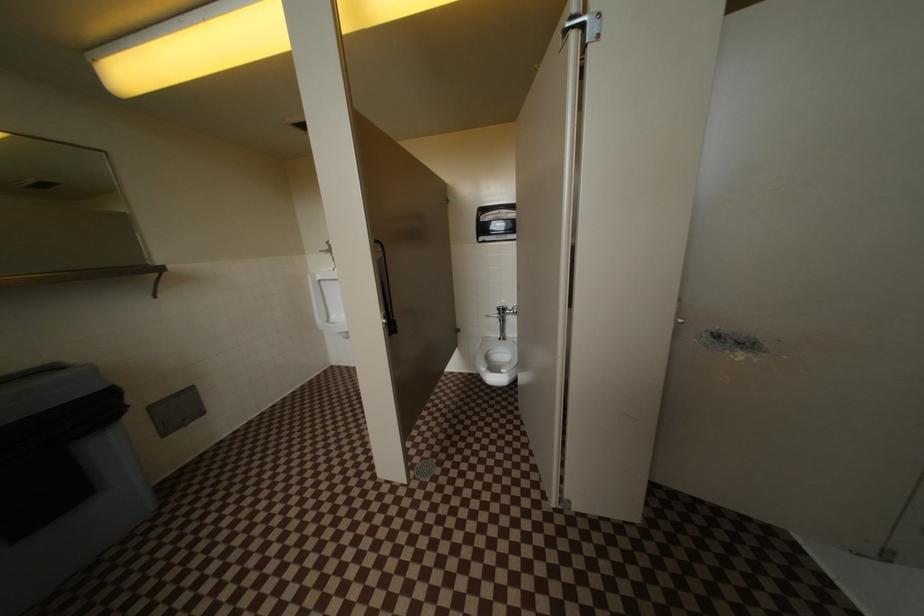
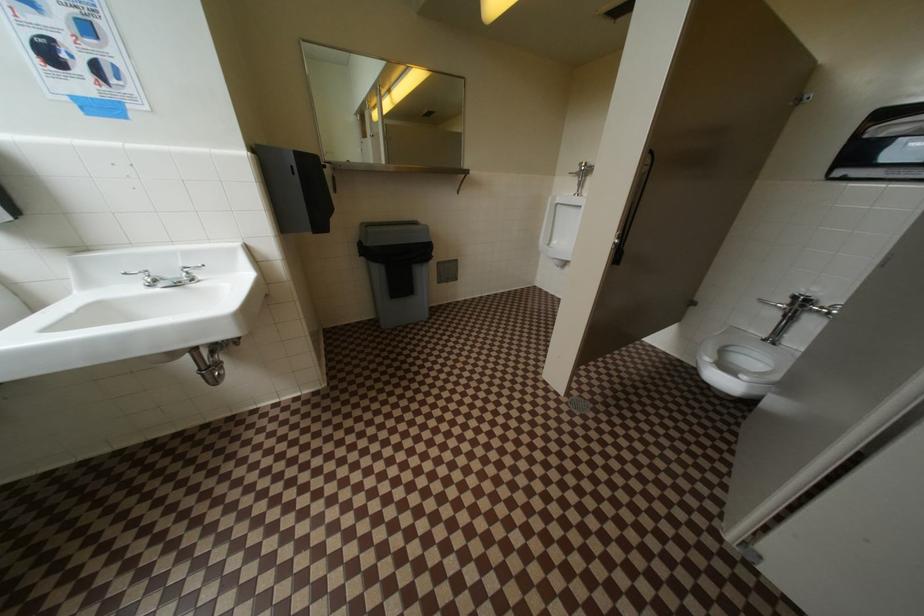
How did the camera likely rotate?

The camera rotated toward left-down.